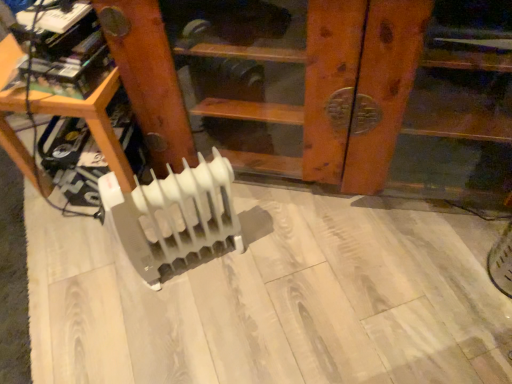
Locate an element on the screen. white plastic radiator at center, which is the 1th furniture from right to left is located at coordinates point(274,66).

The height and width of the screenshot is (384, 512). What are the coordinates of `white plastic radiator at center, which is the 1th furniture from right to left` in the screenshot? It's located at (274, 66).

In the scene shown: Which is more to the right, white plastic radiator at center, which is the second furniture in left-to-right order, or white plastic radiator at lower center, positioned as the 1th furniture in left-to-right order?

white plastic radiator at center, which is the second furniture in left-to-right order, is more to the right.

Between white plastic radiator at center, which is the second furniture in left-to-right order, and white plastic radiator at lower center, positioned as the 1th furniture in left-to-right order, which one has larger size?

With larger size is white plastic radiator at center, which is the second furniture in left-to-right order.

Between white plastic radiator at center, which is the 1th furniture from right to left, and white plastic radiator at lower center, which is the 2th furniture from right to left, which one has less height?

white plastic radiator at lower center, which is the 2th furniture from right to left.

Considering their positions, is white plastic radiator at center, which is the second furniture in left-to-right order, located in front of or behind white plastic radiator at lower center, which is the 2th furniture from right to left?

In the image, white plastic radiator at center, which is the second furniture in left-to-right order, appears in front of white plastic radiator at lower center, which is the 2th furniture from right to left.

Which point is more forward, (161, 183) or (18, 139)?

The point (161, 183) is in front.

From the picture: Is white plastic radiator at center surrounding white plastic radiator at lower center, positioned as the 1th furniture in left-to-right order?

No, white plastic radiator at center does not contain white plastic radiator at lower center, positioned as the 1th furniture in left-to-right order.

Between white plastic radiator at center and white plastic radiator at lower center, positioned as the 1th furniture in left-to-right order, which one appears on the left side from the viewer's perspective?

white plastic radiator at lower center, positioned as the 1th furniture in left-to-right order.

Is the depth of white plastic radiator at center greater than that of white plastic radiator at lower center, positioned as the 1th furniture in left-to-right order?

No, white plastic radiator at center is closer to the camera.

In the scene shown: From a real-world perspective, who is located lower, white plastic radiator at lower center, which is the 2th furniture from right to left, or white plastic radiator at center, which is the 1th furniture from right to left?

white plastic radiator at lower center, which is the 2th furniture from right to left, from a real-world perspective.

From the image's perspective, which one is positioned lower, white plastic radiator at lower center, positioned as the 1th furniture in left-to-right order, or white plastic radiator at center, which is the 1th furniture from right to left?

white plastic radiator at lower center, positioned as the 1th furniture in left-to-right order, is shown below in the image.

Is white plastic radiator at lower center, positioned as the 1th furniture in left-to-right order, touching white plastic radiator at center, which is the second furniture in left-to-right order?

No, white plastic radiator at lower center, positioned as the 1th furniture in left-to-right order, is not in contact with white plastic radiator at center, which is the second furniture in left-to-right order.

I want to click on furniture that appears above the white plastic radiator at lower center, which is the 2th furniture from right to left (from the image's perspective), so click(x=274, y=66).

Between white plastic radiator at lower center, which is the 2th furniture from right to left, and white plastic radiator at center, which one has smaller width?

With smaller width is white plastic radiator at center.

Does white plastic radiator at lower center, which is the 2th furniture from right to left, have a larger size compared to white plastic radiator at center?

Yes.

Consider the image. Measure the distance between white plastic radiator at lower center, positioned as the 1th furniture in left-to-right order, and white plastic radiator at center.

white plastic radiator at lower center, positioned as the 1th furniture in left-to-right order, and white plastic radiator at center are 8.77 inches apart.

From a real-world perspective, is white plastic radiator at center physically below white plastic radiator at center, which is the 1th furniture from right to left?

Yes, from a real-world perspective, white plastic radiator at center is under white plastic radiator at center, which is the 1th furniture from right to left.

Considering the relative positions of white plastic radiator at center and white plastic radiator at center, which is the second furniture in left-to-right order, in the image provided, is white plastic radiator at center to the left of white plastic radiator at center, which is the second furniture in left-to-right order, from the viewer's perspective?

Correct, you'll find white plastic radiator at center to the left of white plastic radiator at center, which is the second furniture in left-to-right order.

From the image's perspective, is white plastic radiator at center above white plastic radiator at center, which is the 1th furniture from right to left?

No, from the image's perspective, white plastic radiator at center is not above white plastic radiator at center, which is the 1th furniture from right to left.

Is white plastic radiator at center, which is the second furniture in left-to-right order, positioned with its back to white plastic radiator at center?

No.

Is white plastic radiator at center located within white plastic radiator at center, which is the 1th furniture from right to left?

That's incorrect, white plastic radiator at center is not inside white plastic radiator at center, which is the 1th furniture from right to left.

From the image's perspective, is white plastic radiator at center, which is the 1th furniture from right to left, over white plastic radiator at center?

Yes.

Locate an element on the screen. furniture above the white plastic radiator at lower center, positioned as the 1th furniture in left-to-right order (from the image's perspective) is located at coordinates (274, 66).

Where is `radiator located in front of the white plastic radiator at lower center, positioned as the 1th furniture in left-to-right order`? Image resolution: width=512 pixels, height=384 pixels. radiator located in front of the white plastic radiator at lower center, positioned as the 1th furniture in left-to-right order is located at coordinates (173, 215).

When comparing their distances from white plastic radiator at center, which is the 1th furniture from right to left, does white plastic radiator at lower center, positioned as the 1th furniture in left-to-right order, or white plastic radiator at center seem closer?

The object closer to white plastic radiator at center, which is the 1th furniture from right to left, is white plastic radiator at center.

Considering their positions, is white plastic radiator at center positioned further to white plastic radiator at center, which is the 1th furniture from right to left, than white plastic radiator at lower center, positioned as the 1th furniture in left-to-right order?

The object further to white plastic radiator at center, which is the 1th furniture from right to left, is white plastic radiator at lower center, positioned as the 1th furniture in left-to-right order.

Considering their positions, is white plastic radiator at center, which is the 1th furniture from right to left, positioned further to white plastic radiator at center than white plastic radiator at lower center, which is the 2th furniture from right to left?

white plastic radiator at center, which is the 1th furniture from right to left, is positioned further to the anchor white plastic radiator at center.

When comparing their distances from white plastic radiator at lower center, positioned as the 1th furniture in left-to-right order, does white plastic radiator at center or white plastic radiator at center, which is the second furniture in left-to-right order, seem further?

white plastic radiator at center, which is the second furniture in left-to-right order, lies further to white plastic radiator at lower center, positioned as the 1th furniture in left-to-right order, than the other object.

Consider the image. Estimate the real-world distances between objects in this image. Which object is further from white plastic radiator at lower center, which is the 2th furniture from right to left, white plastic radiator at center, which is the second furniture in left-to-right order, or white plastic radiator at center?

white plastic radiator at center, which is the second furniture in left-to-right order, is further to white plastic radiator at lower center, which is the 2th furniture from right to left.

From the image, which object appears to be nearer to white plastic radiator at center, white plastic radiator at lower center, positioned as the 1th furniture in left-to-right order, or white plastic radiator at center, which is the 1th furniture from right to left?

white plastic radiator at lower center, positioned as the 1th furniture in left-to-right order, lies closer to white plastic radiator at center than the other object.

Find the location of a particular element. Image resolution: width=512 pixels, height=384 pixels. radiator located between white plastic radiator at lower center, positioned as the 1th furniture in left-to-right order, and white plastic radiator at center, which is the second furniture in left-to-right order, in the left-right direction is located at coordinates (173, 215).